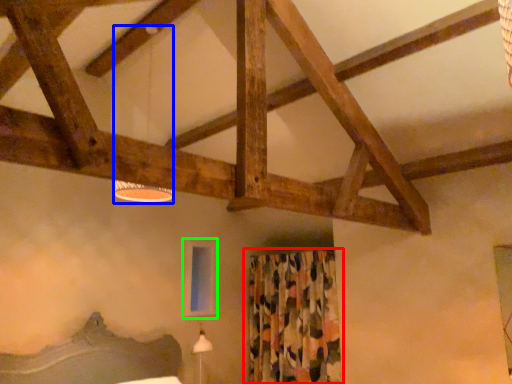
Question: Which object is the farthest from curtain (highlighted by a red box)? Choose among these: lamp (highlighted by a blue box) or window screen (highlighted by a green box).

Choices:
 (A) lamp
 (B) window screen

Answer: (A)